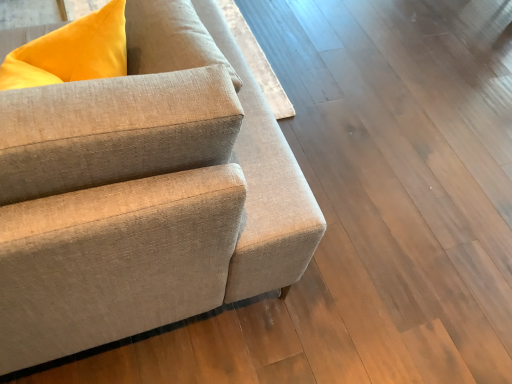
Measure the distance between textured beige couch at center and camera.

They are 20.42 inches apart.

The width and height of the screenshot is (512, 384). What are the coordinates of `textured beige couch at center` in the screenshot? It's located at (142, 205).

The height and width of the screenshot is (384, 512). What do you see at coordinates (142, 205) in the screenshot?
I see `textured beige couch at center` at bounding box center [142, 205].

Where is `textured beige couch at center`? Image resolution: width=512 pixels, height=384 pixels. textured beige couch at center is located at coordinates (142, 205).